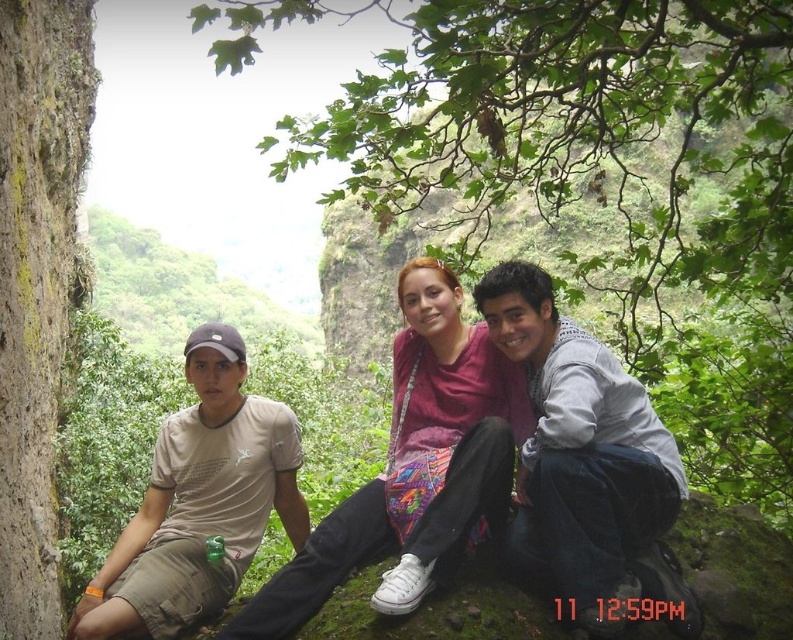
Question: Which of the following is the farthest from the observer?

Choices:
 (A) (167, 524)
 (B) (364, 540)
 (C) (439, 412)

Answer: (C)

Question: Does matte pink shirt at center have a larger size compared to matte pink sweater at center?

Choices:
 (A) no
 (B) yes

Answer: (B)

Question: Which of the following is the farthest from the observer?

Choices:
 (A) [x=726, y=276]
 (B) [x=485, y=481]

Answer: (A)

Question: Can you confirm if light blue denim jeans at center is smaller than beige cotton t-shirt at left?

Choices:
 (A) no
 (B) yes

Answer: (B)

Question: Is beige cotton t-shirt at left below matte pink sweater at center?

Choices:
 (A) yes
 (B) no

Answer: (A)

Question: Which point is closer to the camera taking this photo?

Choices:
 (A) 412,346
 (B) 610,442
 (C) 426,131

Answer: (B)